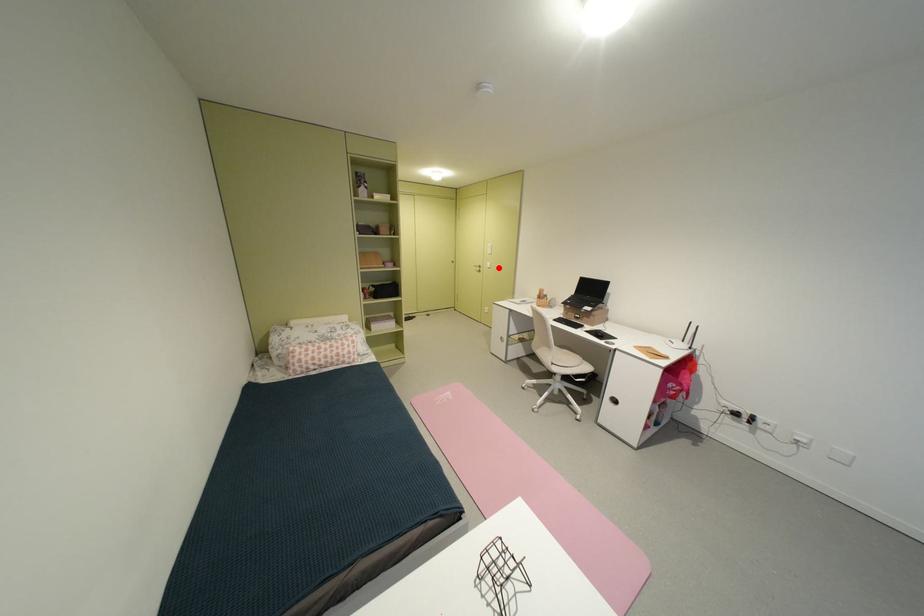
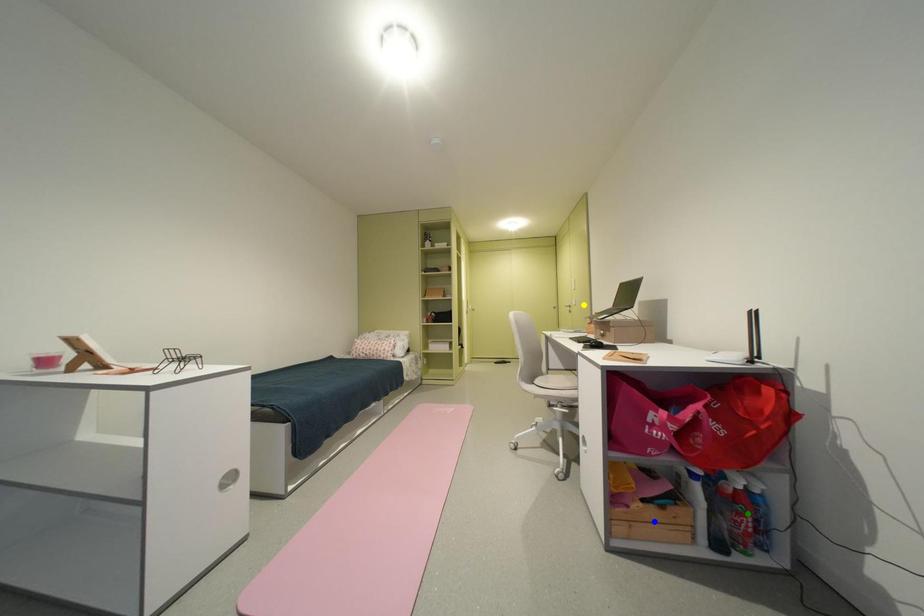
Question: I am providing you with two images of the same scene from different viewpoints. A red point is marked on the first image. You are given multiple points on the second image. Which mark in image 2 goes with the point in image 1?

Choices:
 (A) green point
 (B) blue point
 (C) yellow point

Answer: (C)